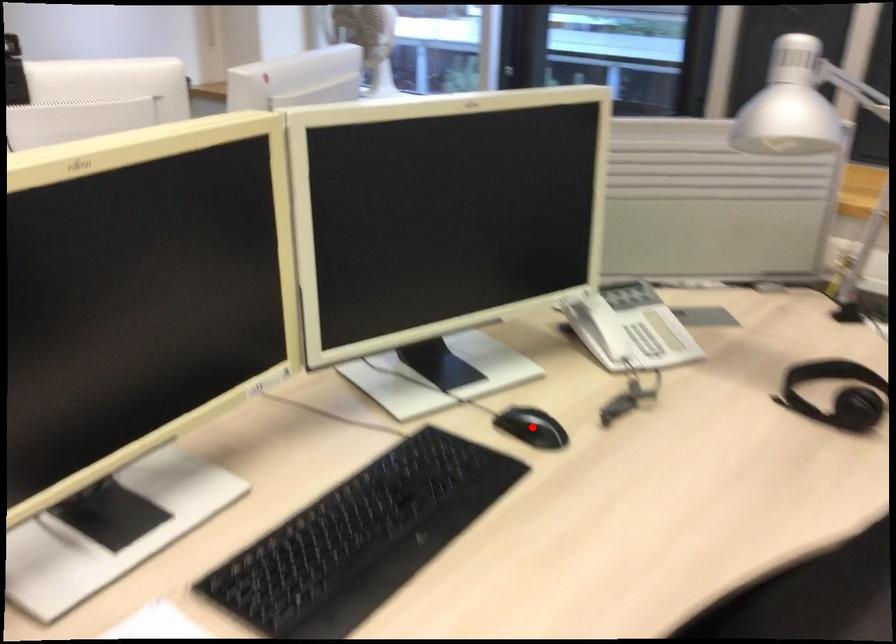
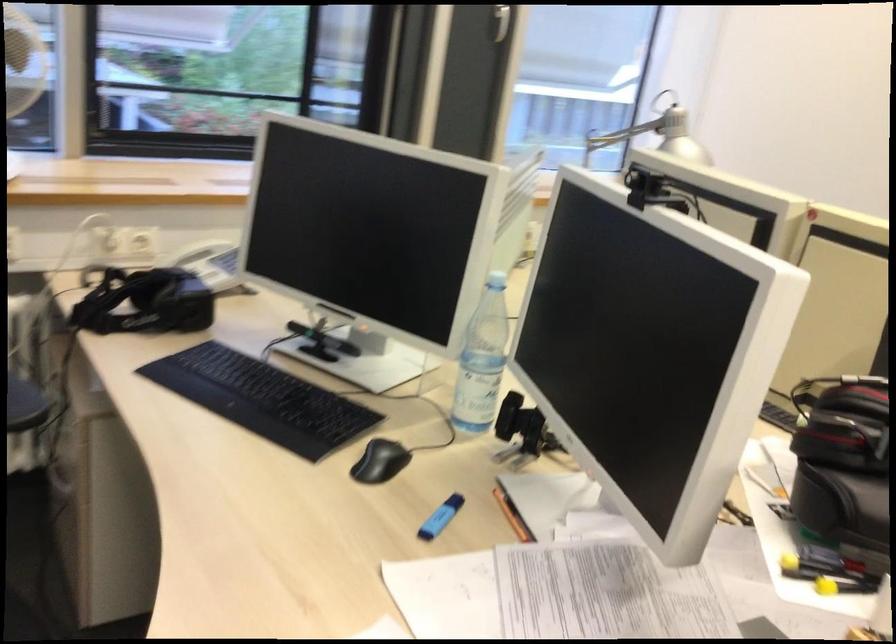
Question: I am providing you with two images of the same scene from different viewpoints. A red point is marked on the first image. Is the red point's position out of view in image 2?

Choices:
 (A) Yes
 (B) No

Answer: (A)